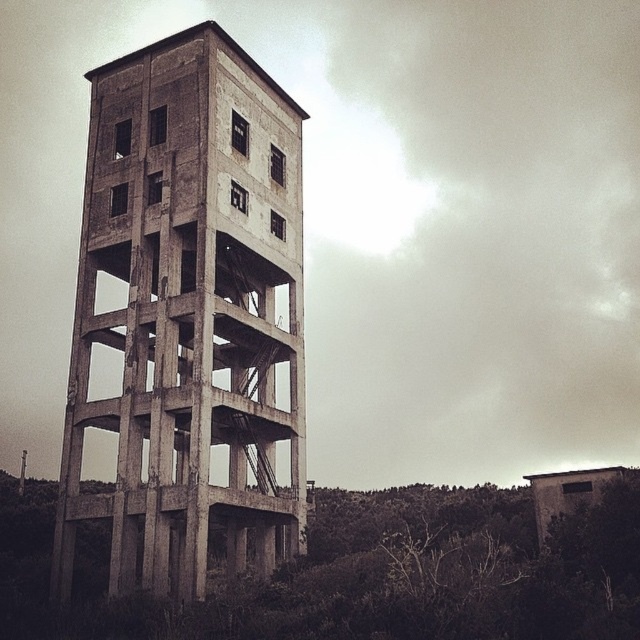
You are a maintenance worker assessing the condition of the concrete tower at center and the concrete structure at center. Which one is positioned higher up in the scene?

The concrete tower at center is located above the concrete structure at center, so it is positioned higher up in the scene.

You are standing near the abandoned concrete tower and want to reach a specific point marked at coordinates point (186, 442). If your current position is 50 meters away from that point, can you safely walk directly to it without needing to adjust your path?

The point (186, 442) is 50.88 meters away from the viewer. Since your current position is 50 meters away, you are already very close. However, you might need to adjust your path slightly as there could be obstacles like overgrown vegetation or structural hazards near the tower base that aren

You are a drone operator planning to fly your drone from your current position to the top of the concrete tower at center. Given that your drone has a maximum flight range of 40 meters, will it be able to reach the top without needing to recharge?

The distance between the concrete tower at center and the camera is 38.67 meters, which is within the drone operator maximum flight range of 40 meters. Therefore, the drone can reach the top of the concrete tower at center without needing to recharge.